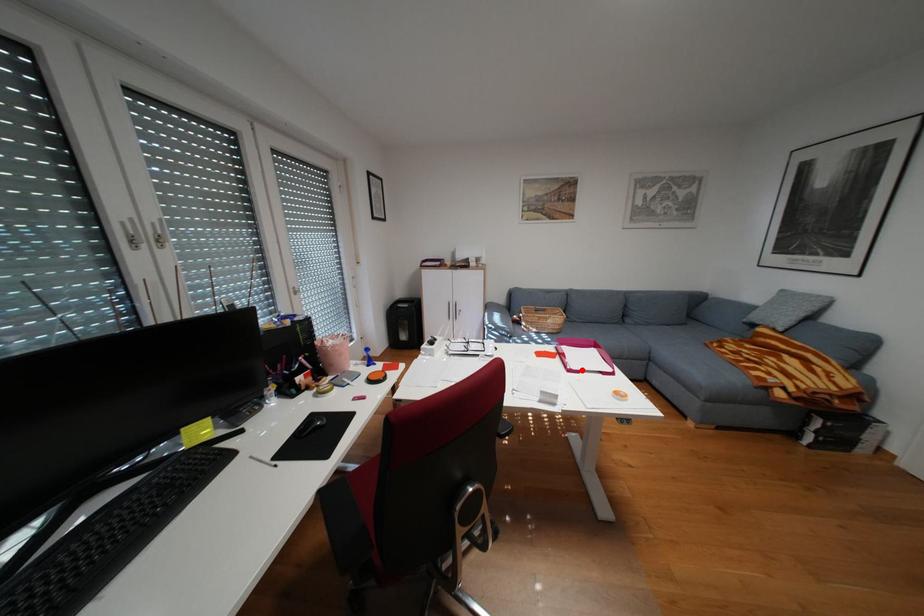
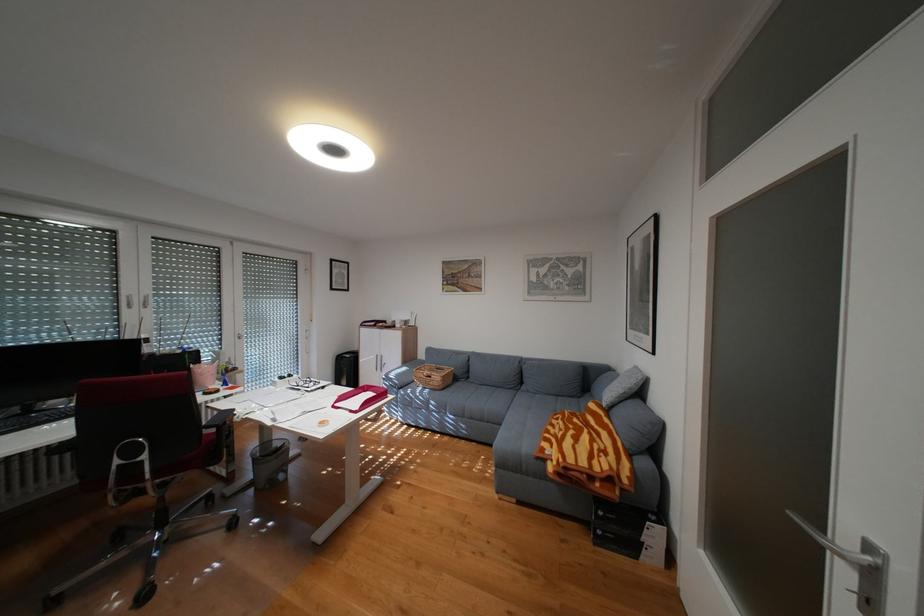
Find the pixel in the second image that matches the highlighted location in the first image.

(346, 406)